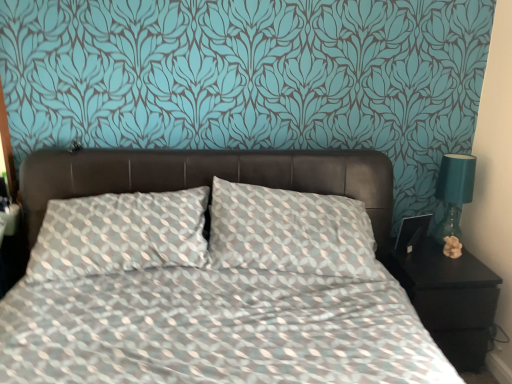
At what (x,y) coordinates should I click in order to perform the action: click on free space in front of teal glass lamp at right. Please return your answer as a coordinate pair (x, y). Looking at the image, I should click on (442, 266).